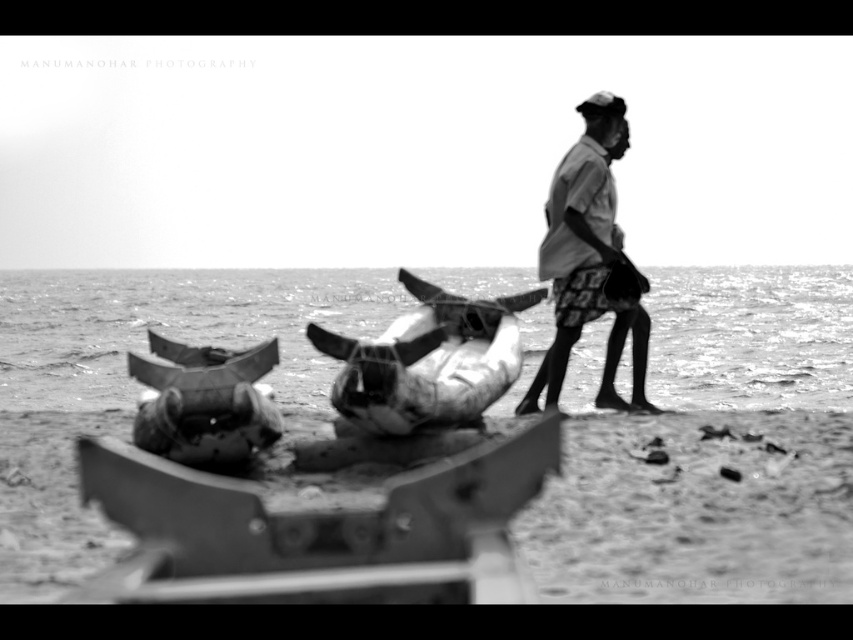
Can you confirm if rusty metal boat at center is smaller than light gray fabric shirt at right?

No, rusty metal boat at center is not smaller than light gray fabric shirt at right.

Between rusty metal boat at center and light gray fabric shirt at right, which one has more height?

Standing taller between the two is light gray fabric shirt at right.

Describe the element at coordinates (428, 360) in the screenshot. I see `rusty metal boat at center` at that location.

Locate an element on the screen. rusty metal boat at center is located at coordinates (428, 360).